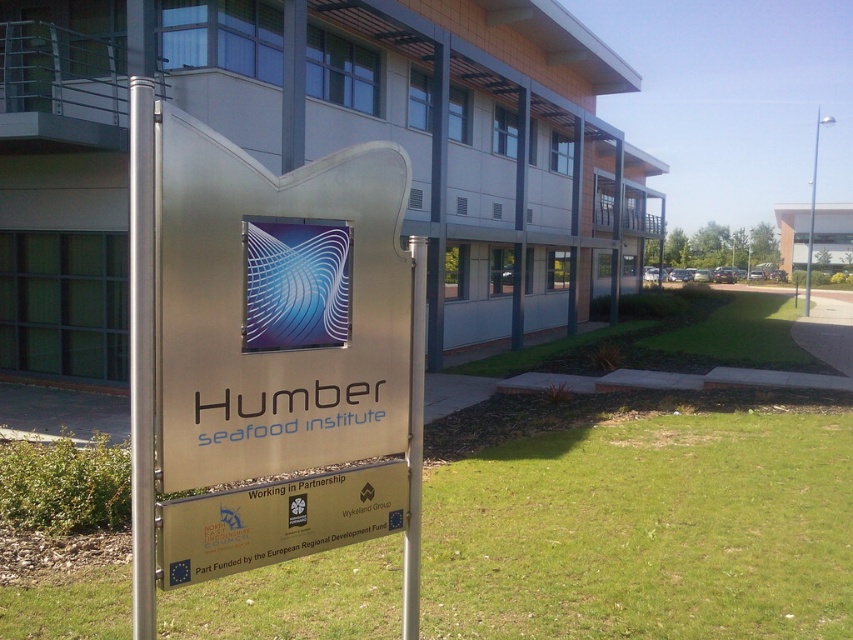
Does gold metallic sign at center have a smaller size compared to silver metallic pole at upper right?

Yes, gold metallic sign at center is smaller than silver metallic pole at upper right.

Is gold metallic sign at center above silver metallic pole at upper right?

Incorrect, gold metallic sign at center is not positioned above silver metallic pole at upper right.

Image resolution: width=853 pixels, height=640 pixels. Describe the element at coordinates (277, 522) in the screenshot. I see `gold metallic sign at center` at that location.

The height and width of the screenshot is (640, 853). Identify the location of gold metallic sign at center. (277, 522).

Is point (263, 173) positioned in front of point (805, 264)?

That is True.

Does brushed metal sign at center have a greater width compared to silver metallic pole at upper right?

No.

Describe the element at coordinates (270, 355) in the screenshot. The width and height of the screenshot is (853, 640). I see `brushed metal sign at center` at that location.

Identify the location of brushed metal sign at center. The height and width of the screenshot is (640, 853). (270, 355).

Is green grass at lower center to the left of silver metallic pole at upper right from the viewer's perspective?

Yes, green grass at lower center is to the left of silver metallic pole at upper right.

Does green grass at lower center come in front of silver metallic pole at upper right?

That is True.

Which is in front, point (479, 570) or point (809, 230)?

Point (479, 570) is in front.

Find the location of a particular element. The image size is (853, 640). green grass at lower center is located at coordinates (646, 531).